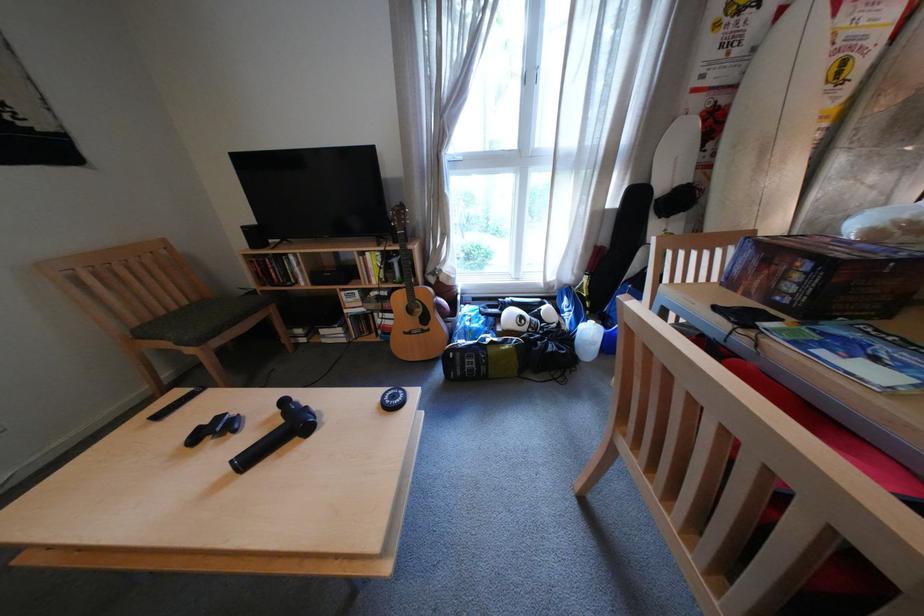
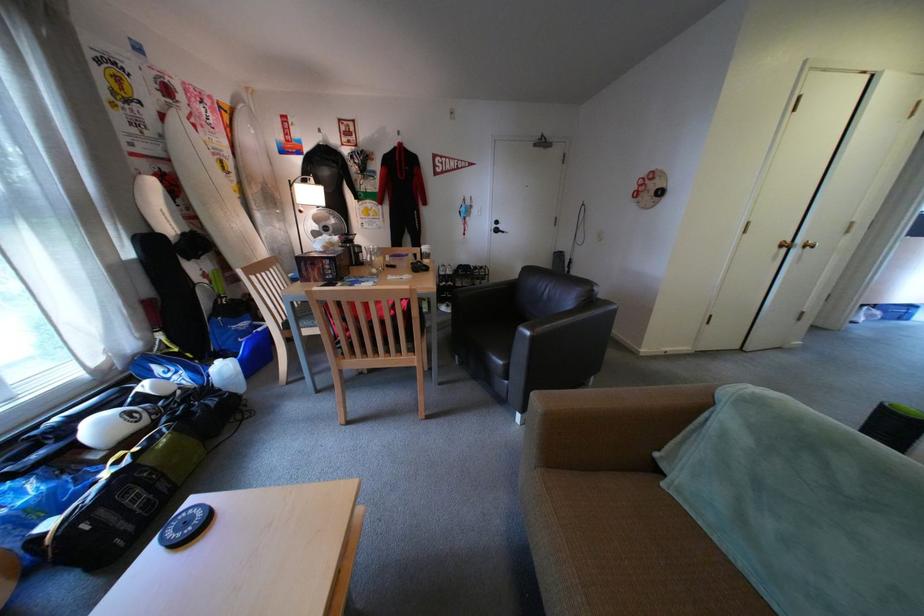
The point at (407, 398) is marked in the first image. Where is the corresponding point in the second image?

(199, 525)